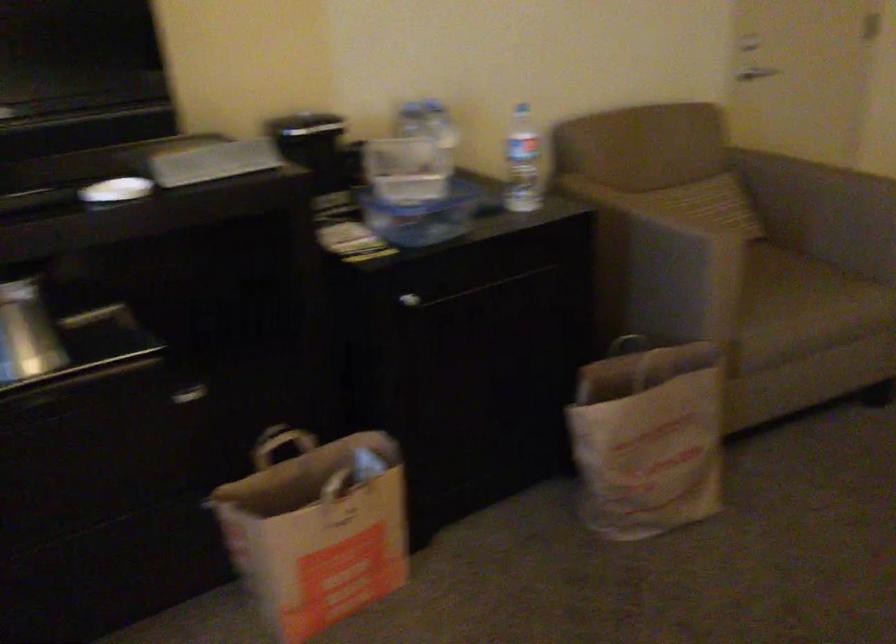
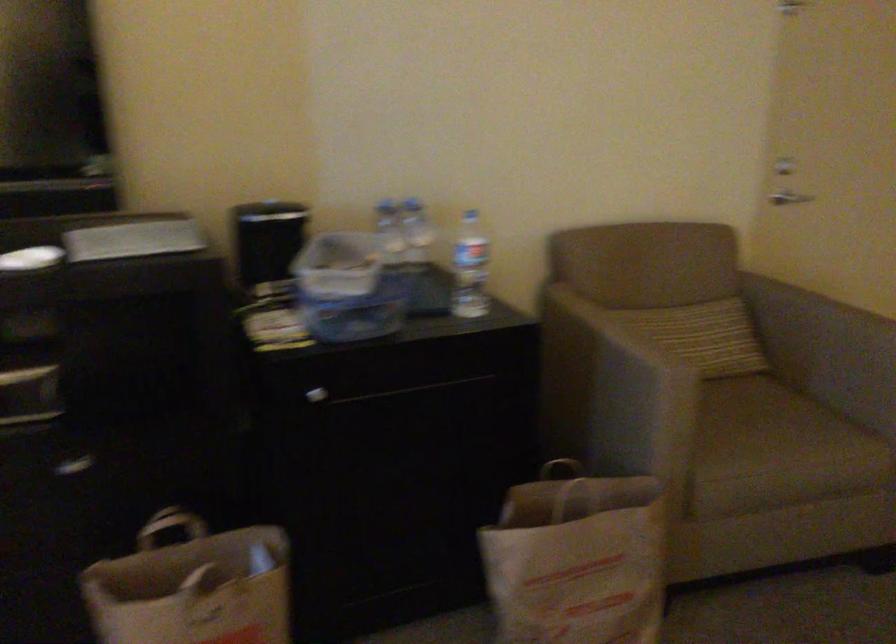
Locate, in the second image, the point that corresponds to pixel 407 299 in the first image.

(316, 395)